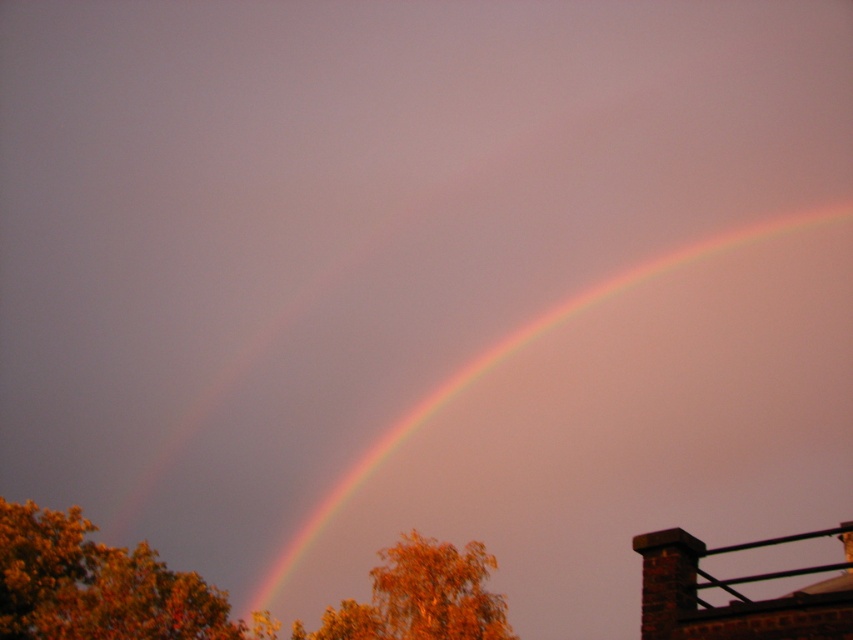
Between rainbow at upper center and orange leafy tree at center, which one has less height?

orange leafy tree at center

Based on the photo, is rainbow at upper center further to the viewer compared to orange leafy tree at center?

No, rainbow at upper center is closer to the viewer.

Identify the location of rainbow at upper center. The height and width of the screenshot is (640, 853). (616, 433).

Is point (669, 461) more distant than point (88, 636)?

Yes.

Consider the image. Can you confirm if rainbow at upper center is positioned to the right of autumn leaves at lower left?

Correct, you'll find rainbow at upper center to the right of autumn leaves at lower left.

Between point (619, 476) and point (19, 621), which one is positioned in front?

Point (19, 621)

This screenshot has width=853, height=640. In order to click on rainbow at upper center in this screenshot , I will do `click(616, 433)`.

Does autumn leaves at lower left appear on the left side of orange leafy tree at center?

Correct, you'll find autumn leaves at lower left to the left of orange leafy tree at center.

Is autumn leaves at lower left positioned in front of orange leafy tree at center?

That is True.

The height and width of the screenshot is (640, 853). Describe the element at coordinates (96, 586) in the screenshot. I see `autumn leaves at lower left` at that location.

Identify the location of autumn leaves at lower left. tap(96, 586).